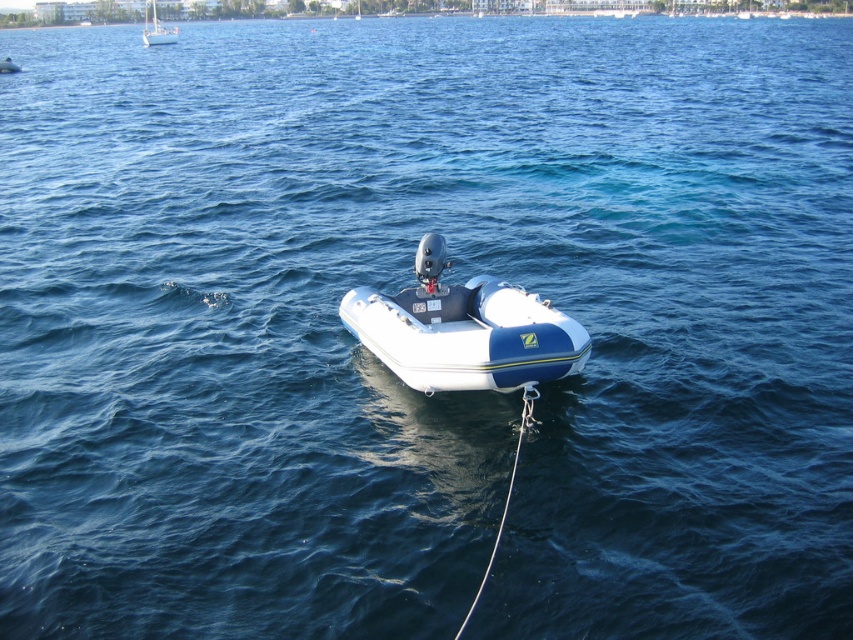
You are navigating a small inflatable boat and need to determine the direction to steer. You observe two points plotted on your map corresponding to coordinates point (486, 296) and point (160, 44). Which point is closer to your current position if you are facing the direction of the boat motor?

Point (486, 296) is in front of point (160, 44), so if you are facing the direction of the boat motor, point (486, 296) is closer to your current position.

You are planning to take a photo of the white rubber boat at center and the white glossy sailboat at upper left. Since you want both boats to be in the same frame, which boat should you position your camera closer to?

You should position your camera closer to the white rubber boat at center because it is located below the white glossy sailboat at upper left, so moving closer to the lower boat will help include both in the frame.